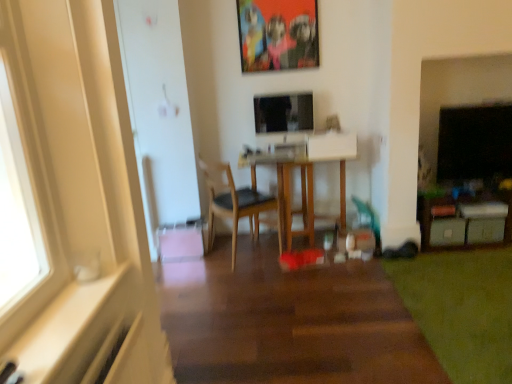
Question: Is wooden table at center closer to camera compared to green soft carpet at lower right?

Choices:
 (A) yes
 (B) no

Answer: (B)

Question: Considering the relative sizes of wooden table at center and green soft carpet at lower right in the image provided, is wooden table at center wider than green soft carpet at lower right?

Choices:
 (A) no
 (B) yes

Answer: (A)

Question: Considering the relative sizes of wooden table at center and green soft carpet at lower right in the image provided, is wooden table at center shorter than green soft carpet at lower right?

Choices:
 (A) no
 (B) yes

Answer: (A)

Question: Is there a large distance between wooden table at center and green soft carpet at lower right?

Choices:
 (A) yes
 (B) no

Answer: (A)

Question: Is green soft carpet at lower right at the back of wooden table at center?

Choices:
 (A) no
 (B) yes

Answer: (A)

Question: Which is correct: wooden chair at center is inside green soft carpet at lower right, or outside of it?

Choices:
 (A) outside
 (B) inside

Answer: (A)

Question: In terms of size, does wooden chair at center appear bigger or smaller than green soft carpet at lower right?

Choices:
 (A) big
 (B) small

Answer: (A)

Question: From a real-world perspective, is wooden chair at center physically located above or below green soft carpet at lower right?

Choices:
 (A) above
 (B) below

Answer: (A)

Question: From the image's perspective, is wooden chair at center located above or below green soft carpet at lower right?

Choices:
 (A) below
 (B) above

Answer: (B)

Question: From the image's perspective, is green soft carpet at lower right positioned above or below wooden chair at center?

Choices:
 (A) below
 (B) above

Answer: (A)

Question: From a real-world perspective, is green soft carpet at lower right positioned above or below wooden chair at center?

Choices:
 (A) below
 (B) above

Answer: (A)

Question: Based on their sizes in the image, would you say green soft carpet at lower right is bigger or smaller than wooden chair at center?

Choices:
 (A) small
 (B) big

Answer: (A)

Question: Considering their positions, is green soft carpet at lower right located in front of or behind wooden chair at center?

Choices:
 (A) behind
 (B) front

Answer: (B)

Question: Visually, is green soft carpet at lower right positioned to the left or to the right of white plastic drawer at lower right, the 1th drawer in the right-to-left sequence?

Choices:
 (A) right
 (B) left

Answer: (B)

Question: Does point (455, 352) appear closer or farther from the camera than point (502, 238)?

Choices:
 (A) farther
 (B) closer

Answer: (B)